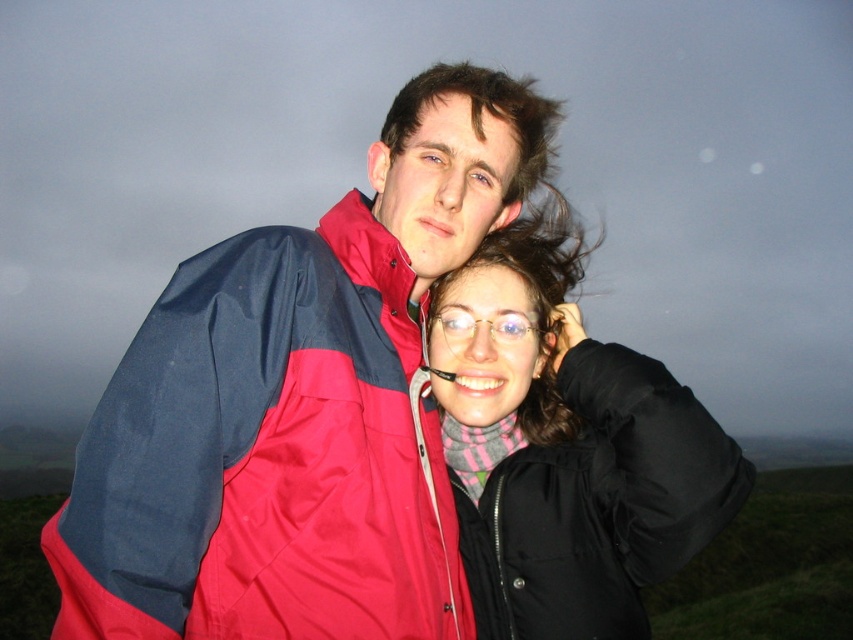
You are using a coordinate system where the bottom left corner is the origin. The red nylon jacket at center is at point 0.714, 0.312. If you want to place a marker at the exact center of the image, which coordinate would you use?

The exact center of the image would be at coordinates (426,320). The red nylon jacket at center is located at (265,456), which is to the right and slightly below the center point.

You are a photographer trying to capture a group photo of the two people wearing the red nylon jacket at center and the black matte jacket at center. The minimum distance required for your camera to focus clearly is 30 inches. Can you take the photo without moving either person?

The red nylon jacket at center is 33.33 inches from the black matte jacket at center. Since the distance between them is greater than the minimum focus requirement of 30 inches, the photographer can take the photo without moving either person.

You are trying to decide which jacket to wear for a walk in the hills. You want a jacket that reaches your waist. Which of the two jackets, the red nylon jacket at center or the black matte jacket at center, is more suitable?

The red nylon jacket at center is shorter than the black matte jacket at center, so the red nylon jacket at center is more suitable for reaching your waist.